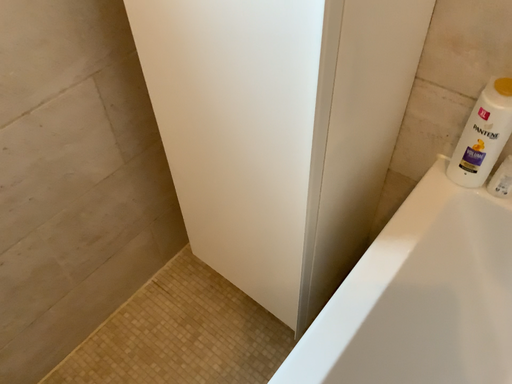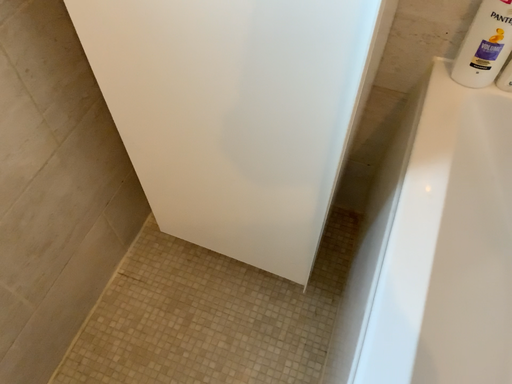
Question: Which way did the camera rotate in the video?

Choices:
 (A) rotated left
 (B) rotated right

Answer: (B)